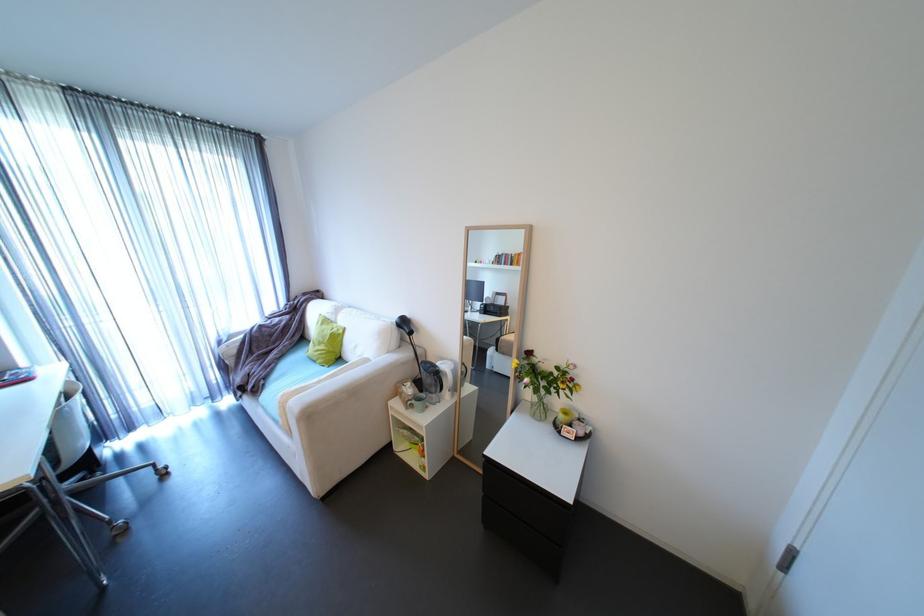
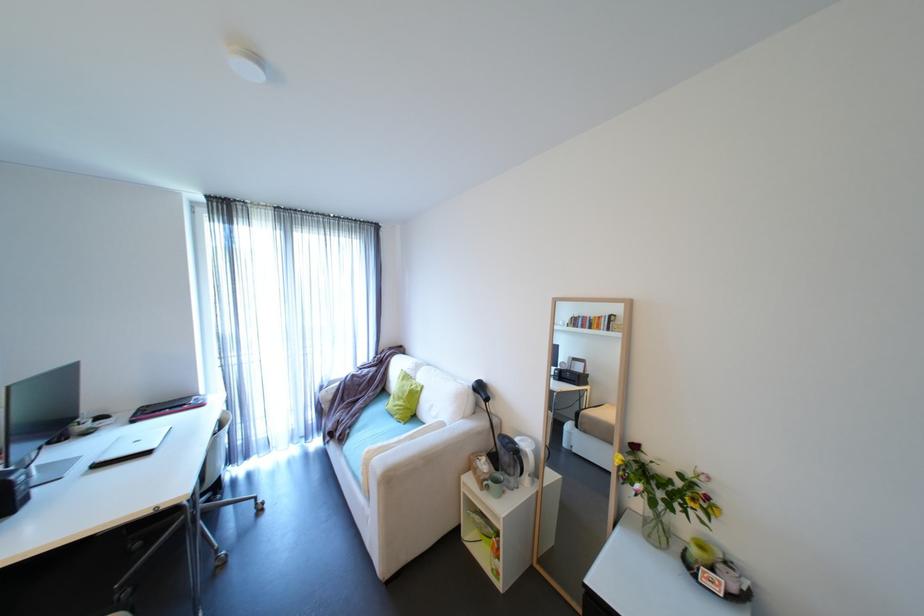
In the second image, find the point that corresponds to (x=333, y=346) in the first image.

(411, 402)